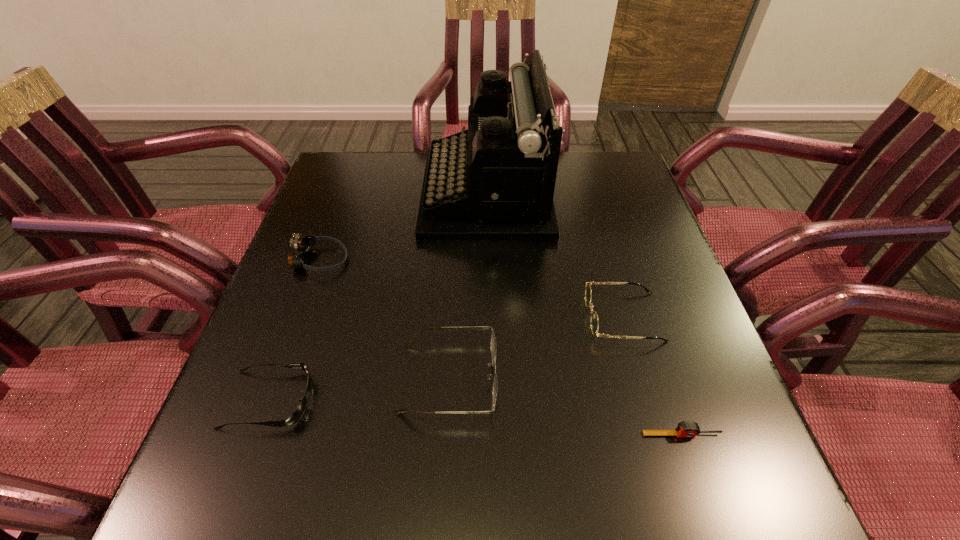
The height and width of the screenshot is (540, 960). What are the coordinates of `vacant space situated on the lenses of the right spectacles` in the screenshot? It's located at (x=515, y=317).

This screenshot has height=540, width=960. In order to click on free region located 0.240m on the lenses of the right spectacles in this screenshot , I will do `click(471, 317)`.

Where is `free space located on the lenses of the right spectacles`? The width and height of the screenshot is (960, 540). free space located on the lenses of the right spectacles is located at coordinates (403, 317).

Where is `vacant region located through the lenses of the goggles`? The height and width of the screenshot is (540, 960). vacant region located through the lenses of the goggles is located at coordinates (459, 260).

The height and width of the screenshot is (540, 960). Find the location of `vacant region located 0.120m on the front-facing side of the left spectacles`. vacant region located 0.120m on the front-facing side of the left spectacles is located at coordinates (562, 378).

Locate an element on the screen. vacant area situated 0.300m on the front-facing side of the sunglasses is located at coordinates (479, 400).

Where is `free space located on the left of the tape measure`? This screenshot has width=960, height=540. free space located on the left of the tape measure is located at coordinates (411, 435).

This screenshot has width=960, height=540. Identify the location of object present at the far edge. (495, 181).

Locate an element on the screen. The width and height of the screenshot is (960, 540). goggles positioned at the left edge is located at coordinates (301, 244).

The height and width of the screenshot is (540, 960). In order to click on sunglasses positioned at the left edge in this screenshot , I will do `click(299, 411)`.